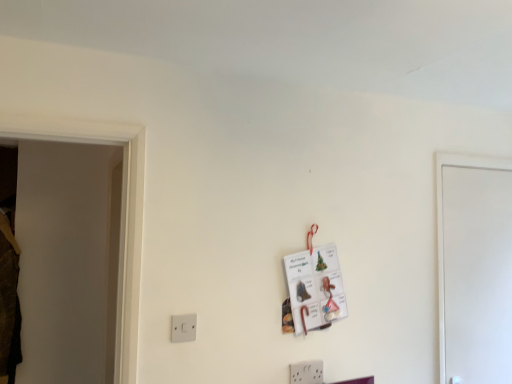
Question: Would you say white matte door at right is outside white plastic light switch at lower left?

Choices:
 (A) no
 (B) yes

Answer: (B)

Question: Considering the relative positions of white matte door at right and white plastic light switch at lower left in the image provided, is white matte door at right behind white plastic light switch at lower left?

Choices:
 (A) yes
 (B) no

Answer: (A)

Question: Is white matte door at right smaller than white plastic light switch at lower left?

Choices:
 (A) no
 (B) yes

Answer: (A)

Question: Does white matte door at right have a greater width compared to white plastic light switch at lower left?

Choices:
 (A) yes
 (B) no

Answer: (A)

Question: Does white matte door at right have a lesser width compared to white plastic light switch at lower left?

Choices:
 (A) no
 (B) yes

Answer: (A)

Question: Does white matte door at right turn towards white plastic light switch at lower left?

Choices:
 (A) no
 (B) yes

Answer: (A)

Question: Is white plastic light switch at lower left not close to white matte door at right?

Choices:
 (A) yes
 (B) no

Answer: (A)

Question: Is white plastic light switch at lower left facing towards white matte door at right?

Choices:
 (A) no
 (B) yes

Answer: (A)

Question: Is white plastic light switch at lower left looking in the opposite direction of white matte door at right?

Choices:
 (A) yes
 (B) no

Answer: (B)

Question: Is white plastic light switch at lower left at the left side of white matte door at right?

Choices:
 (A) yes
 (B) no

Answer: (A)

Question: From a real-world perspective, is white plastic light switch at lower left physically above white matte door at right?

Choices:
 (A) no
 (B) yes

Answer: (A)

Question: Considering the relative sizes of white plastic light switch at lower left and white matte door at right in the image provided, is white plastic light switch at lower left taller than white matte door at right?

Choices:
 (A) yes
 (B) no

Answer: (B)

Question: From the image's perspective, is white plastic light switch at lower left above or below white matte door at right?

Choices:
 (A) above
 (B) below

Answer: (B)